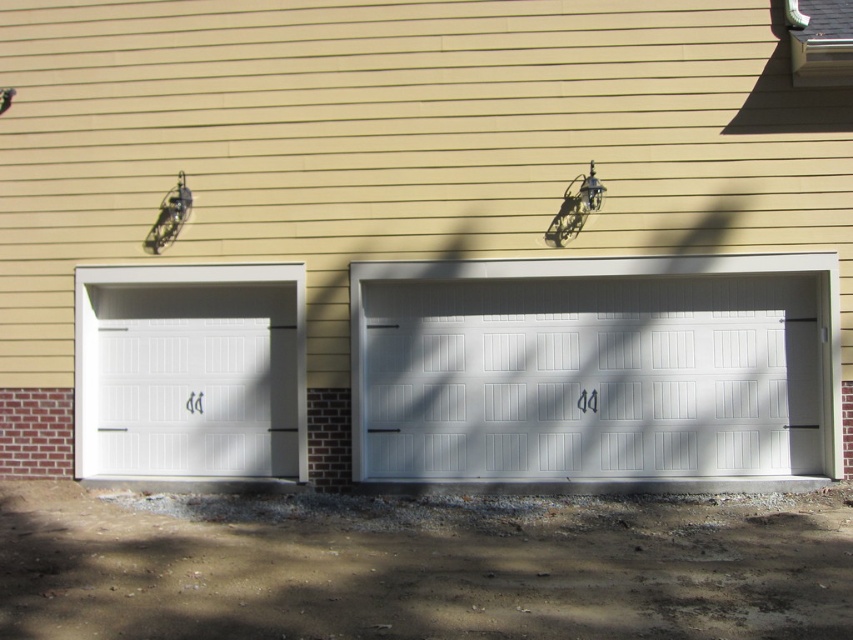
You are standing in front of the residential building and want to enter the garage. You notice two white painted wood garage doors. Which garage door, the white painted wood garage door at center or the white painted wood garage door at left, is nearer to you?

The white painted wood garage door at center is closer to the viewer than the white painted wood garage door at left, so the white painted wood garage door at center is nearer to you.

You are a delivery person trying to park your van in the garage. The van requires a garage door that is at least 3 meters wide. You see two garage doors in front of you, the white painted wood garage door at center and the white painted wood garage door at left. Which garage door should you choose to ensure your van fits?

The white painted wood garage door at left is wider than the white painted wood garage door at center. Since the van requires a garage door at least 3 meters wide, you should choose the white painted wood garage door at left if its width meets or exceeds the required measurement.

From the picture: You are standing in front of the residential building with two garage doors. You notice two points marked on the facade. One is at coordinate point(183,540) and the other at point(583,304). Which point is closer to you?

Point(183,540) is in front of point(583,304), so it is closer to you.